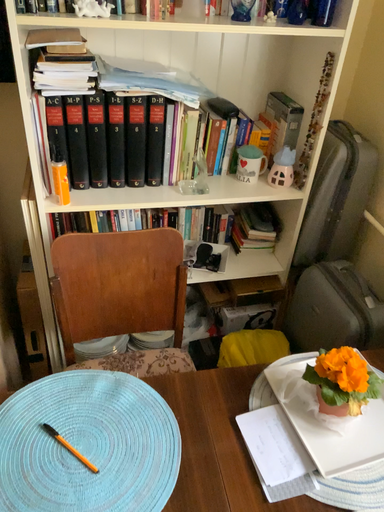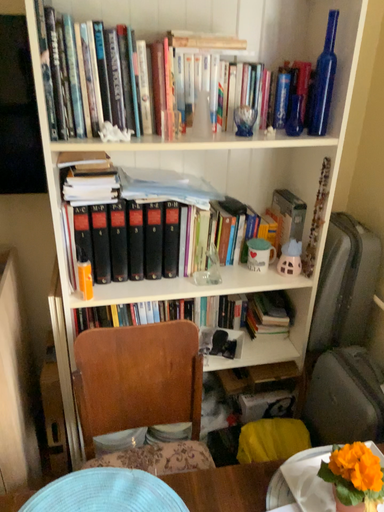
Question: How did the camera likely rotate when shooting the video?

Choices:
 (A) rotated downward
 (B) rotated upward

Answer: (B)